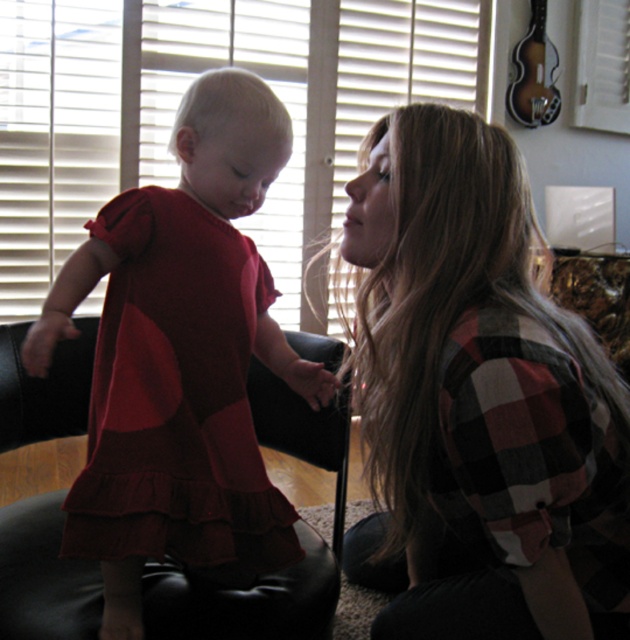
Question: Which point is farther from the camera taking this photo?

Choices:
 (A) (398, 20)
 (B) (532, 276)
 (C) (168, 342)

Answer: (A)

Question: Can you confirm if matte red dress at left is bigger than white matte blinds at upper center?

Choices:
 (A) yes
 (B) no

Answer: (B)

Question: Is plaid flannel shirt at center positioned before matte red dress at left?

Choices:
 (A) yes
 (B) no

Answer: (A)

Question: Which object is positioned closest to the white matte blinds at upper center?

Choices:
 (A) matte red dress at left
 (B) plaid flannel shirt at center

Answer: (A)

Question: Which point is closer to the camera taking this photo?

Choices:
 (A) (461, 582)
 (B) (324, 188)

Answer: (A)

Question: Is matte red dress at left thinner than white matte blinds at upper center?

Choices:
 (A) no
 (B) yes

Answer: (B)